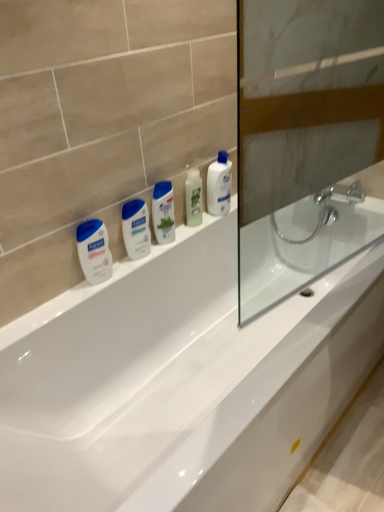
Question: Considering the relative sizes of green matte mouthwash at center, which ranks as the third mouthwash in left-to-right order, and white glossy mouthwash at center, which is counted as the fourth mouthwash, starting from the left, in the image provided, is green matte mouthwash at center, which ranks as the third mouthwash in left-to-right order, bigger than white glossy mouthwash at center, which is counted as the fourth mouthwash, starting from the left,?

Choices:
 (A) yes
 (B) no

Answer: (A)

Question: Does green matte mouthwash at center, which ranks as the third mouthwash in left-to-right order, lie behind white glossy mouthwash at center, which is the first mouthwash in right-to-left order?

Choices:
 (A) no
 (B) yes

Answer: (A)

Question: Is white glossy mouthwash at center, which is counted as the fourth mouthwash, starting from the left, completely or partially inside green matte mouthwash at center, marked as the 2th mouthwash in a right-to-left arrangement?

Choices:
 (A) no
 (B) yes

Answer: (A)

Question: From a real-world perspective, is green matte mouthwash at center, which ranks as the third mouthwash in left-to-right order, beneath white glossy mouthwash at center, which is counted as the fourth mouthwash, starting from the left?

Choices:
 (A) no
 (B) yes

Answer: (A)

Question: From a real-world perspective, is green matte mouthwash at center, which ranks as the third mouthwash in left-to-right order, positioned over white glossy mouthwash at center, which is counted as the fourth mouthwash, starting from the left, based on gravity?

Choices:
 (A) no
 (B) yes

Answer: (B)

Question: Relative to transparent glass screen door at right, is green matte mouthwash at center, marked as the 2th mouthwash in a right-to-left arrangement, in front or behind?

Choices:
 (A) front
 (B) behind

Answer: (B)

Question: Is green matte mouthwash at center, which ranks as the third mouthwash in left-to-right order, bigger or smaller than transparent glass screen door at right?

Choices:
 (A) big
 (B) small

Answer: (B)

Question: Which is correct: green matte mouthwash at center, which ranks as the third mouthwash in left-to-right order, is inside transparent glass screen door at right, or outside of it?

Choices:
 (A) outside
 (B) inside

Answer: (A)

Question: Is point (157, 193) closer or farther from the camera than point (367, 129)?

Choices:
 (A) closer
 (B) farther

Answer: (A)

Question: Is white glossy lotion at left, which is the fourth mouthwash in right-to-left order, bigger or smaller than white plastic bottle at center?

Choices:
 (A) big
 (B) small

Answer: (B)

Question: From a real-world perspective, is white glossy lotion at left, which is the fourth mouthwash in right-to-left order, physically located above or below white plastic bottle at center?

Choices:
 (A) below
 (B) above

Answer: (A)

Question: From the image's perspective, relative to white plastic bottle at center, is white glossy lotion at left, which is the fourth mouthwash in right-to-left order, above or below?

Choices:
 (A) above
 (B) below

Answer: (B)

Question: Considering the positions of white glossy lotion at left, the first mouthwash in the left-to-right sequence, and white plastic bottle at center in the image, is white glossy lotion at left, the first mouthwash in the left-to-right sequence, taller or shorter than white plastic bottle at center?

Choices:
 (A) short
 (B) tall

Answer: (A)

Question: Is white glossy mouthwash at center, placed as the third mouthwash when sorted from right to left, inside or outside of white glossy lotion at left, the first mouthwash in the left-to-right sequence?

Choices:
 (A) inside
 (B) outside

Answer: (B)

Question: From a real-world perspective, is white glossy mouthwash at center, placed as the third mouthwash when sorted from right to left, above or below white glossy lotion at left, which is the fourth mouthwash in right-to-left order?

Choices:
 (A) below
 (B) above

Answer: (B)